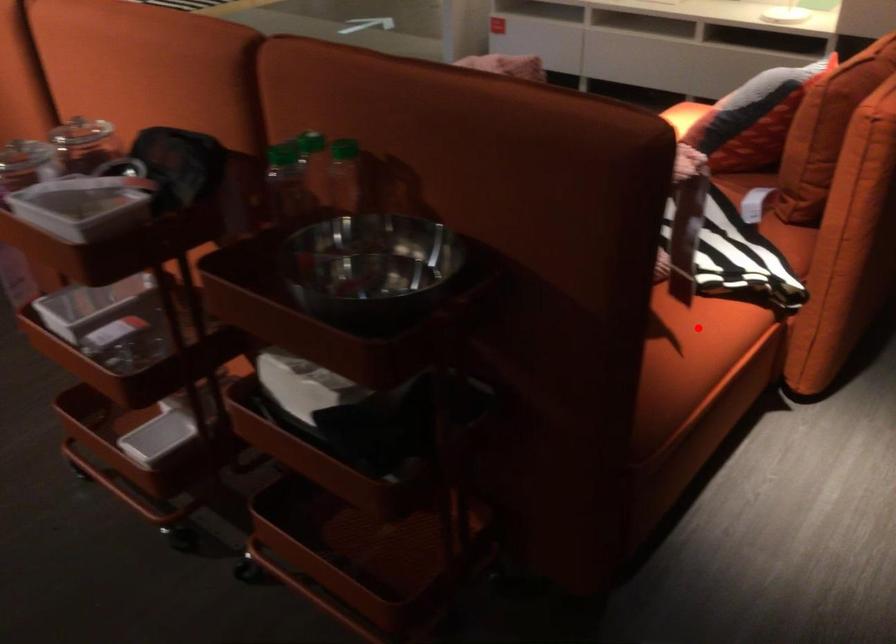
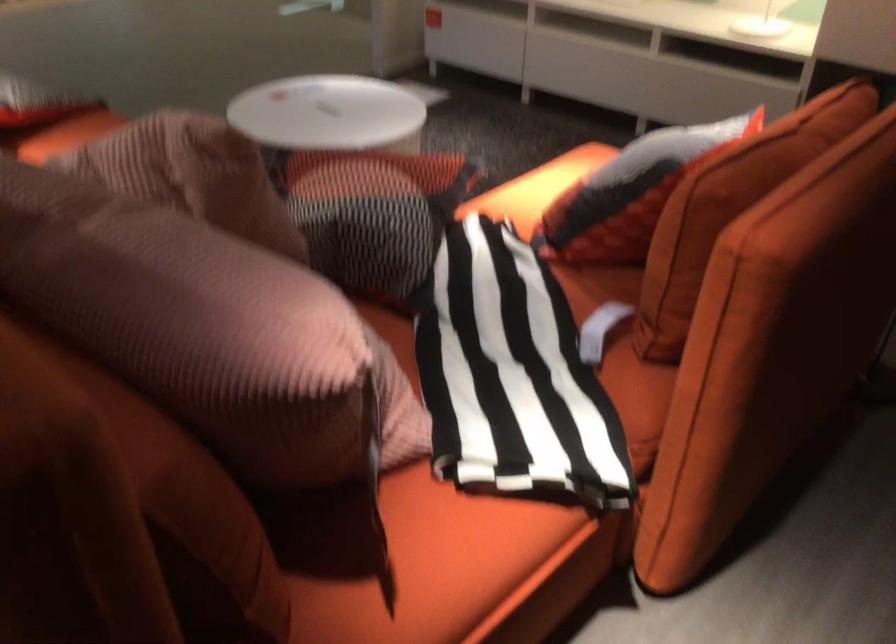
Question: I am providing you with two images of the same scene from different viewpoints. A red point is shown in image1. For the corresponding object point in image2, is it positioned nearer or farther from the camera?

Choices:
 (A) Nearer
 (B) Farther

Answer: (A)